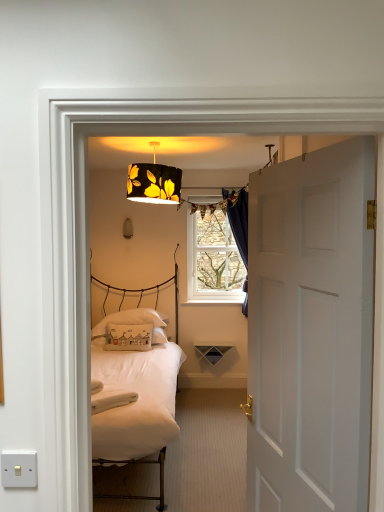
This screenshot has width=384, height=512. I want to click on black fabric lampshade at upper center, the 2th lamp positioned from the right, so click(127, 228).

Measure the distance between point (124,234) and camera.

Point (124,234) is 4.64 meters from camera.

What do you see at coordinates (213, 257) in the screenshot? I see `clear glass window at center` at bounding box center [213, 257].

What do you see at coordinates (311, 331) in the screenshot? I see `white matte door at right` at bounding box center [311, 331].

This screenshot has height=512, width=384. I want to click on white matte door at right, so click(311, 331).

What is the approximate width of white plastic switch at lower left?

white plastic switch at lower left is 0.51 inches wide.

This screenshot has width=384, height=512. Find the location of `white cotton pillow at center, the second pillow when ordered from back to front`. white cotton pillow at center, the second pillow when ordered from back to front is located at coordinates (128, 337).

At what (x,y) coordinates should I click in order to perform the action: click on white fabric pillow at center, the second pillow in the front-to-back sequence. Please return your answer as a coordinate pair (x, y). Image resolution: width=384 pixels, height=512 pixels. Looking at the image, I should click on (136, 322).

Is black fabric lampshade at upper center, the first lamp in the bottom-to-top sequence, wider than clear glass window at center?

No, black fabric lampshade at upper center, the first lamp in the bottom-to-top sequence, is not wider than clear glass window at center.

Is black fabric lampshade at upper center, which is counted as the second lamp, starting from the top, at the left side of clear glass window at center?

Yes.

Is black fabric lampshade at upper center, the first lamp in the bottom-to-top sequence, turned away from clear glass window at center?

No.

Is point (129, 219) closer to camera compared to point (232, 285)?

Yes, point (129, 219) is closer to viewer.

Would you say black fabric lampshade at upper center, the 2th lamp positioned from the right, is to the left or to the right of dark blue velvet curtain at upper center in the picture?

From the image, it's evident that black fabric lampshade at upper center, the 2th lamp positioned from the right, is to the left of dark blue velvet curtain at upper center.

How distant is black fabric lampshade at upper center, the first lamp in the bottom-to-top sequence, from dark blue velvet curtain at upper center?

black fabric lampshade at upper center, the first lamp in the bottom-to-top sequence, is 3.77 feet away from dark blue velvet curtain at upper center.

Does point (126, 232) appear closer or farther from the camera than point (230, 214)?

Point (126, 232) is farther from the camera than point (230, 214).

How many degrees apart are the facing directions of black fabric lampshade at upper center, which is counted as the second lamp, starting from the top, and dark blue velvet curtain at upper center?

There is a 1.9-degree angle between the facing directions of black fabric lampshade at upper center, which is counted as the second lamp, starting from the top, and dark blue velvet curtain at upper center.

Is clear glass window at center next to white plastic switch at lower left and touching it?

No, clear glass window at center is not in contact with white plastic switch at lower left.

Looking at this image, can you confirm if clear glass window at center is bigger than white plastic switch at lower left?

Yes.

Does clear glass window at center appear on the left side of white plastic switch at lower left?

In fact, clear glass window at center is to the right of white plastic switch at lower left.

I want to click on window that is above the white plastic switch at lower left (from a real-world perspective), so click(213, 257).

Considering the sizes of black fabric lampshade at upper center, which ranks as the first lamp in top-to-bottom order, and dark blue velvet curtain at upper center in the image, is black fabric lampshade at upper center, which ranks as the first lamp in top-to-bottom order, wider or thinner than dark blue velvet curtain at upper center?

black fabric lampshade at upper center, which ranks as the first lamp in top-to-bottom order, is wider than dark blue velvet curtain at upper center.

Is black fabric lampshade at upper center, which is the first lamp in right-to-left order, in front of or behind dark blue velvet curtain at upper center in the image?

black fabric lampshade at upper center, which is the first lamp in right-to-left order, is in front of dark blue velvet curtain at upper center.

You are a GUI agent. You are given a task and a screenshot of the screen. Output one action in this format:
    pyautogui.click(x=<x>, y=<y>)
    Task: Click on the 2nd lamp above when counting from the dark blue velvet curtain at upper center (from the image's perspective)
    This screenshot has width=384, height=512.
    Given the screenshot: What is the action you would take?
    pyautogui.click(x=154, y=182)

Considering the relative positions of black fabric lampshade at upper center, the second lamp ordered from the bottom, and dark blue velvet curtain at upper center in the image provided, is black fabric lampshade at upper center, the second lamp ordered from the bottom, to the left of dark blue velvet curtain at upper center from the viewer's perspective?

Indeed, black fabric lampshade at upper center, the second lamp ordered from the bottom, is positioned on the left side of dark blue velvet curtain at upper center.

Is clear glass window at center facing towards white matte door at right?

Yes, clear glass window at center is aimed at white matte door at right.

Considering the points (220, 264) and (255, 404), which point is behind, point (220, 264) or point (255, 404)?

The point (220, 264) is more distant.

Can you confirm if clear glass window at center is shorter than white matte door at right?

Yes, clear glass window at center is shorter than white matte door at right.

Considering the sizes of clear glass window at center and white matte door at right in the image, is clear glass window at center wider or thinner than white matte door at right?

clear glass window at center is thinner than white matte door at right.

What's the angular difference between white matte door at right and dark blue velvet curtain at upper center's facing directions?

The angular difference between white matte door at right and dark blue velvet curtain at upper center is 75.4 degrees.

Does point (321, 461) come behind point (243, 302)?

No, it is not.

Considering the relative sizes of white matte door at right and dark blue velvet curtain at upper center in the image provided, is white matte door at right bigger than dark blue velvet curtain at upper center?

Correct, white matte door at right is larger in size than dark blue velvet curtain at upper center.

From a real-world perspective, between white matte door at right and dark blue velvet curtain at upper center, who is vertically lower?

From a 3D spatial view, white matte door at right is below.

From the image's perspective, relative to black fabric lampshade at upper center, acting as the second lamp starting from the back, is white plastic switch at lower left above or below?

white plastic switch at lower left is below black fabric lampshade at upper center, acting as the second lamp starting from the back.

Consider the image. Is white plastic switch at lower left positioned before black fabric lampshade at upper center, the second lamp ordered from the bottom?

Yes, it is in front of black fabric lampshade at upper center, the second lamp ordered from the bottom.

Is white plastic switch at lower left oriented towards black fabric lampshade at upper center, which is counted as the first lamp, starting from the front?

No, white plastic switch at lower left is not turned towards black fabric lampshade at upper center, which is counted as the first lamp, starting from the front.

Starting from the clear glass window at center, which lamp is the 2nd one to the left? Please provide its 2D coordinates.

[(127, 228)]

You are a GUI agent. You are given a task and a screenshot of the screen. Output one action in this format:
    pyautogui.click(x=<x>, y=<y>)
    Task: Click on the curtain on the right of black fabric lampshade at upper center, positioned as the first lamp in left-to-right order
    Image resolution: width=384 pixels, height=512 pixels.
    Given the screenshot: What is the action you would take?
    pyautogui.click(x=238, y=221)

Which object lies nearer to the anchor point white cotton pillow at center, the second pillow when ordered from back to front, white fabric pillow at center, the second pillow in the front-to-back sequence, or dark blue velvet curtain at upper center?

The object closer to white cotton pillow at center, the second pillow when ordered from back to front, is white fabric pillow at center, the second pillow in the front-to-back sequence.

Consider the image. Looking at the image, which one is located further to black fabric lampshade at upper center, acting as the second lamp starting from the back, black fabric lampshade at upper center, the first lamp in the bottom-to-top sequence, or white matte door at right?

Based on the image, white matte door at right appears to be further to black fabric lampshade at upper center, acting as the second lamp starting from the back.

Considering their positions, is white matte door at right positioned closer to black fabric lampshade at upper center, acting as the second lamp starting from the back, than white plastic switch at lower left?

white matte door at right is closer to black fabric lampshade at upper center, acting as the second lamp starting from the back.

Estimate the real-world distances between objects in this image. Which object is further from white matte door at right, white fabric pillow at center, the second pillow in the front-to-back sequence, or clear glass window at center?

clear glass window at center is further to white matte door at right.

When comparing their distances from white fabric pillow at center, which is the 1th pillow from back to front, does white matte door at right or black fabric lampshade at upper center, positioned as the first lamp in back-to-front order, seem closer?

black fabric lampshade at upper center, positioned as the first lamp in back-to-front order, is positioned closer to the anchor white fabric pillow at center, which is the 1th pillow from back to front.

Considering their positions, is white plastic switch at lower left positioned closer to white matte door at right than black fabric lampshade at upper center, marked as the 2th lamp in a left-to-right arrangement?

white plastic switch at lower left is closer to white matte door at right.

When comparing their distances from dark blue velvet curtain at upper center, does white fabric pillow at center, the second pillow in the front-to-back sequence, or white matte door at right seem further?

white matte door at right is positioned further to the anchor dark blue velvet curtain at upper center.

Considering their positions, is white matte door at right positioned further to white plastic switch at lower left than white fabric pillow at center, the second pillow in the front-to-back sequence?

white fabric pillow at center, the second pillow in the front-to-back sequence.

Where is `lamp between white matte door at right and black fabric lampshade at upper center, the first lamp in the bottom-to-top sequence, in the front-back direction`? lamp between white matte door at right and black fabric lampshade at upper center, the first lamp in the bottom-to-top sequence, in the front-back direction is located at coordinates (154, 182).

Locate an element on the screen. The image size is (384, 512). curtain located between black fabric lampshade at upper center, acting as the second lamp starting from the back, and black fabric lampshade at upper center, the first lamp in the bottom-to-top sequence, in the depth direction is located at coordinates (238, 221).

This screenshot has width=384, height=512. Identify the location of lamp located between white plastic switch at lower left and dark blue velvet curtain at upper center in the depth direction. (154, 182).

Locate an element on the screen. This screenshot has width=384, height=512. pillow situated between white fabric pillow at center, the second pillow in the front-to-back sequence, and clear glass window at center from left to right is located at coordinates (128, 337).